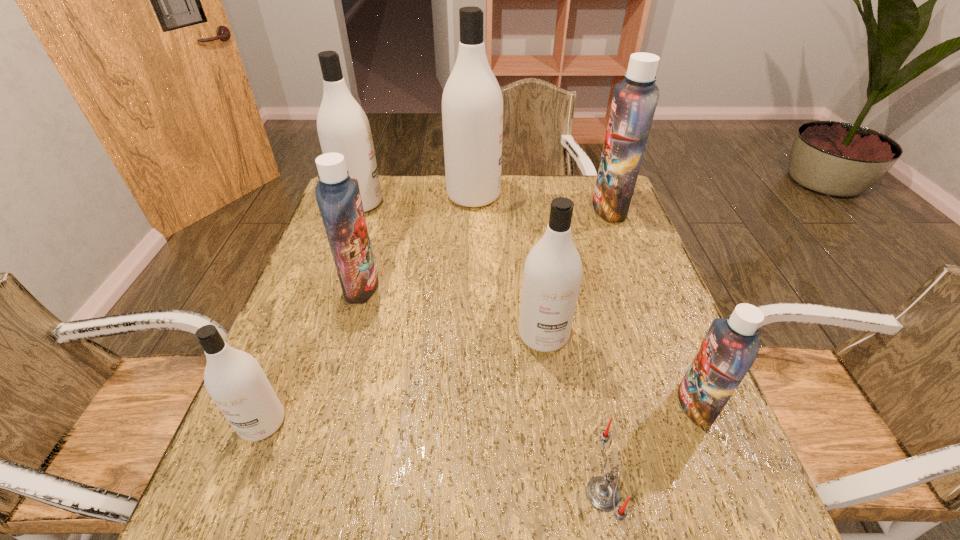
The height and width of the screenshot is (540, 960). I want to click on blank space at the near edge, so click(x=315, y=503).

In the image, there is a desktop. Identify the location of free space at the left edge. (333, 339).

In the image, there is a desktop. Where is `vacant space at the right edge`? vacant space at the right edge is located at coordinates coord(643,242).

This screenshot has width=960, height=540. I want to click on free space between the third smallest white shampoo and the nearest white shampoo, so click(x=311, y=313).

You are a GUI agent. You are given a task and a screenshot of the screen. Output one action in this format:
    pyautogui.click(x=<x>, y=<y>)
    Task: Click on the vacant space in between the smallest blue shampoo and the second white shampoo from right to left
    Image resolution: width=960 pixels, height=540 pixels.
    Given the screenshot: What is the action you would take?
    pyautogui.click(x=585, y=300)

Identify the location of free point between the nearest blue shampoo and the shortest object. This screenshot has height=540, width=960. (649, 449).

Find the location of `free space between the second smallest white shampoo and the fourth shampoo from right to left`. free space between the second smallest white shampoo and the fourth shampoo from right to left is located at coordinates (509, 265).

This screenshot has height=540, width=960. What are the coordinates of `vacant area between the fifth farthest shampoo and the fourth shampoo from right to left` in the screenshot? It's located at (509, 265).

You are a GUI agent. You are given a task and a screenshot of the screen. Output one action in this format:
    pyautogui.click(x=<x>, y=<y>)
    Task: Click on the vacant region between the second biggest white shampoo and the red candle
    
    Given the screenshot: What is the action you would take?
    pyautogui.click(x=481, y=348)

I want to click on vacant region between the smallest blue shampoo and the nearest white shampoo, so click(479, 413).